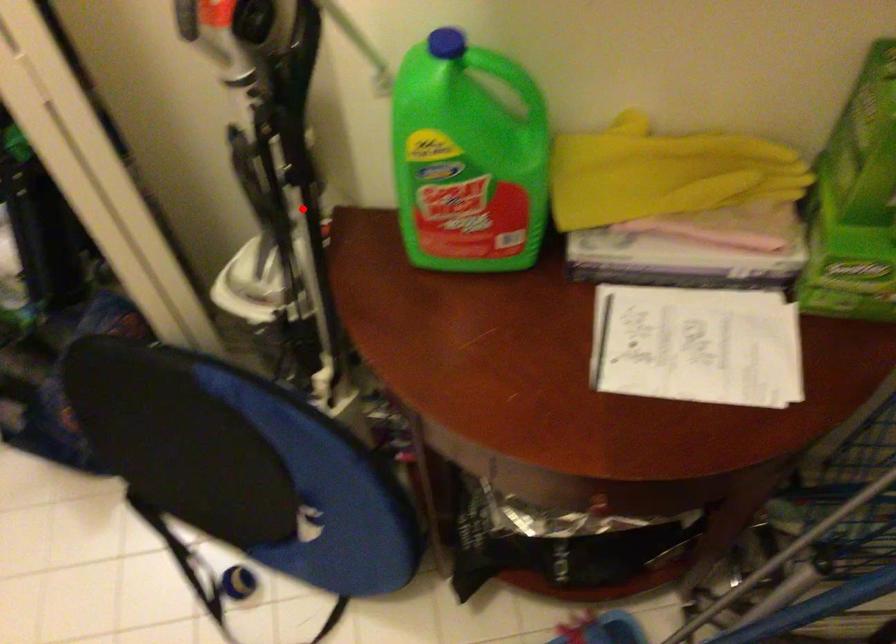
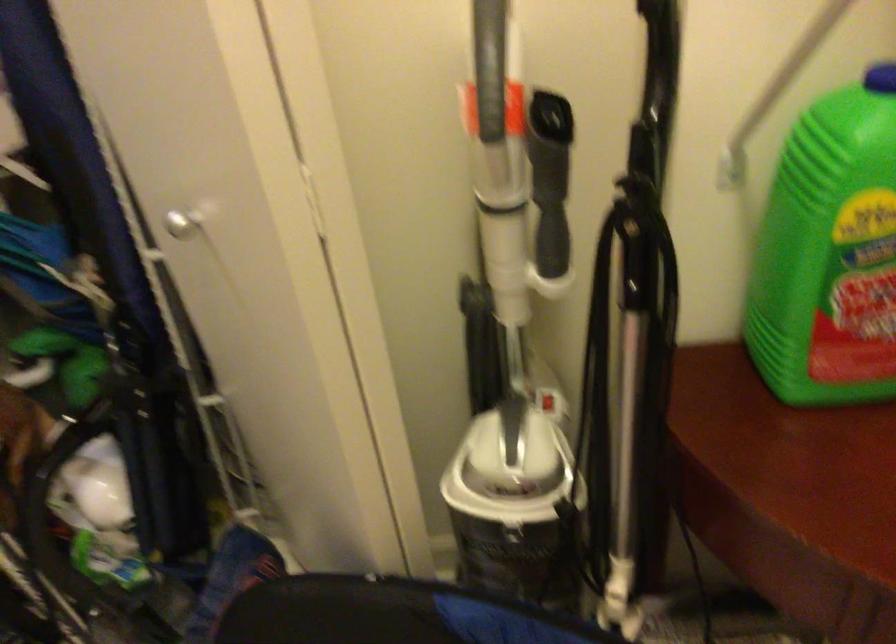
In the second image, find the point that corresponds to the highlighted location in the first image.

(633, 348)